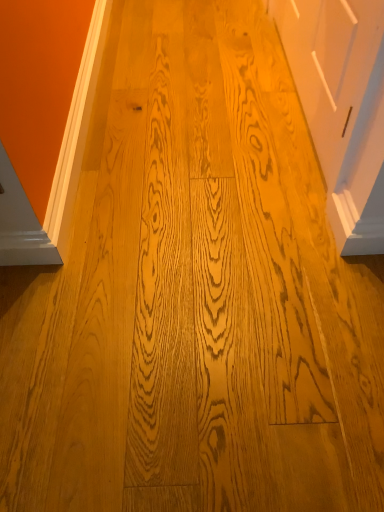
What are the coordinates of `white matte door at upper right` in the screenshot? It's located at (342, 106).

What do you see at coordinates (342, 106) in the screenshot? Image resolution: width=384 pixels, height=512 pixels. I see `white matte door at upper right` at bounding box center [342, 106].

Measure the distance between white matte door at upper right and camera.

white matte door at upper right and camera are 38.26 inches apart.

I want to click on white matte door at upper right, so click(x=342, y=106).